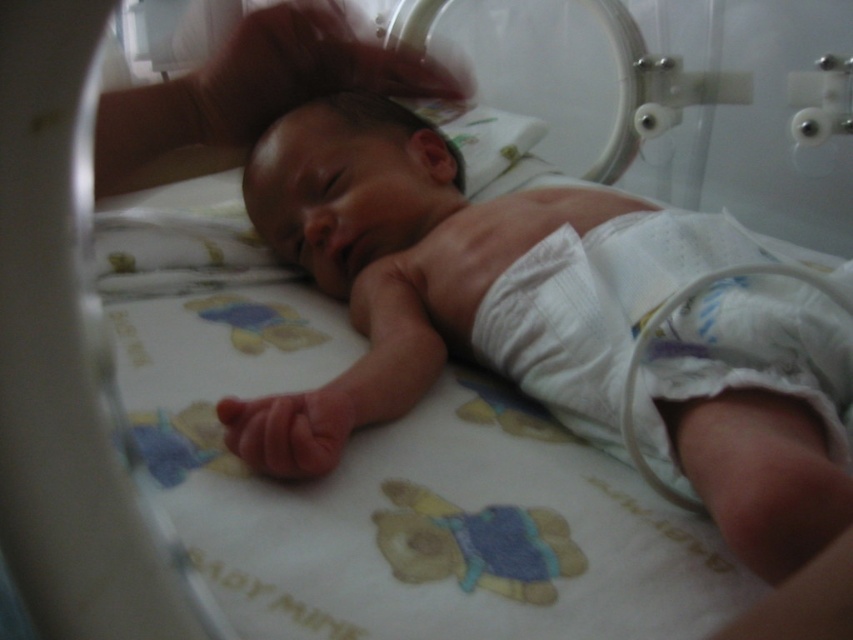
Between smooth white newborn at center and white cloth diaper at lower right, which one appears on the left side from the viewer's perspective?

From the viewer's perspective, smooth white newborn at center appears more on the left side.

Can you confirm if smooth white newborn at center is positioned above white cloth diaper at lower right?

Yes, smooth white newborn at center is above white cloth diaper at lower right.

Does point (709, 288) lie behind point (616, 294)?

No, it is in front of (616, 294).

Find the location of a particular element. The height and width of the screenshot is (640, 853). smooth white newborn at center is located at coordinates (549, 314).